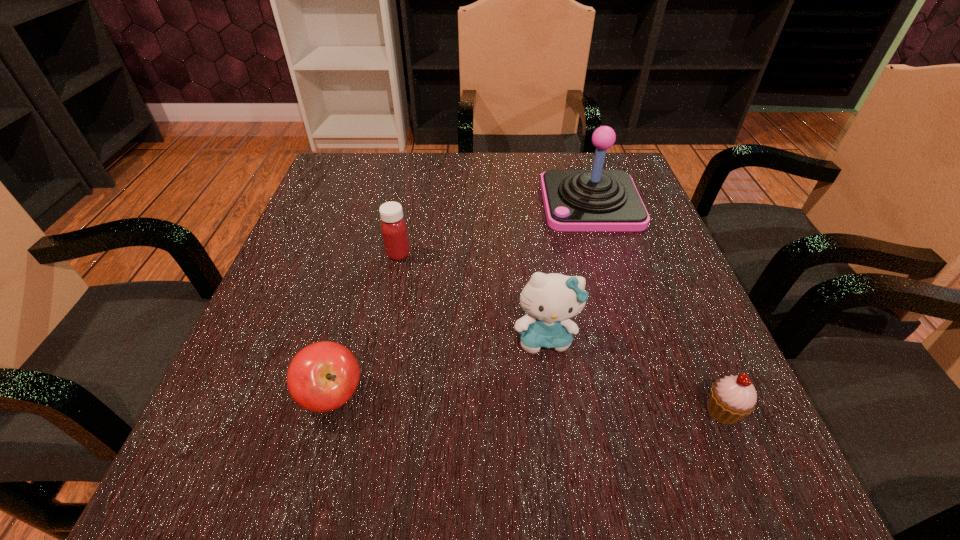
Locate an element on the screen. This screenshot has height=540, width=960. free spot at the near edge of the desktop is located at coordinates (535, 465).

In the image, there is a desktop. At what (x,y) coordinates should I click in order to perform the action: click on free space at the left edge. Please return your answer as a coordinate pair (x, y). Looking at the image, I should click on (342, 320).

Locate an element on the screen. The image size is (960, 540). free location at the right edge is located at coordinates (694, 366).

In the image, there is a desktop. Where is `free region at the far left corner`? The image size is (960, 540). free region at the far left corner is located at coordinates (378, 163).

You are a GUI agent. You are given a task and a screenshot of the screen. Output one action in this format:
    pyautogui.click(x=<x>, y=<y>)
    Task: Click on the vacant region at the near left corner of the desktop
    The image size is (960, 540).
    Given the screenshot: What is the action you would take?
    pyautogui.click(x=272, y=479)

Locate an element on the screen. The width and height of the screenshot is (960, 540). empty space between the farthest object and the kitten is located at coordinates (568, 269).

Locate an element on the screen. blank region between the apple and the cupcake is located at coordinates (528, 403).

Where is `free space between the second farthest object and the kitten`? Image resolution: width=960 pixels, height=540 pixels. free space between the second farthest object and the kitten is located at coordinates (471, 295).

The height and width of the screenshot is (540, 960). What are the coordinates of `empty space between the cupcake and the joystick` in the screenshot? It's located at (657, 307).

The height and width of the screenshot is (540, 960). In order to click on free space between the apple and the second tallest object in this screenshot , I will do (439, 366).